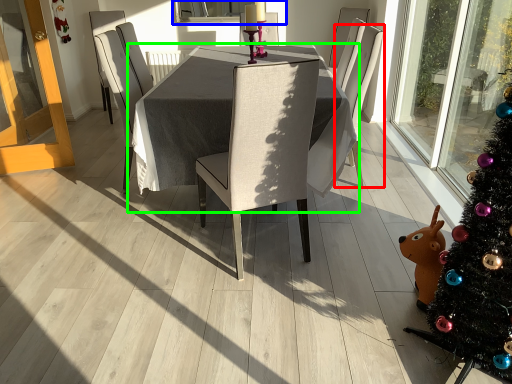
Question: Considering the real-world distances, which object is closest to chair (highlighted by a red box)? window screen (highlighted by a blue box) or table (highlighted by a green box).

Choices:
 (A) window screen
 (B) table

Answer: (B)